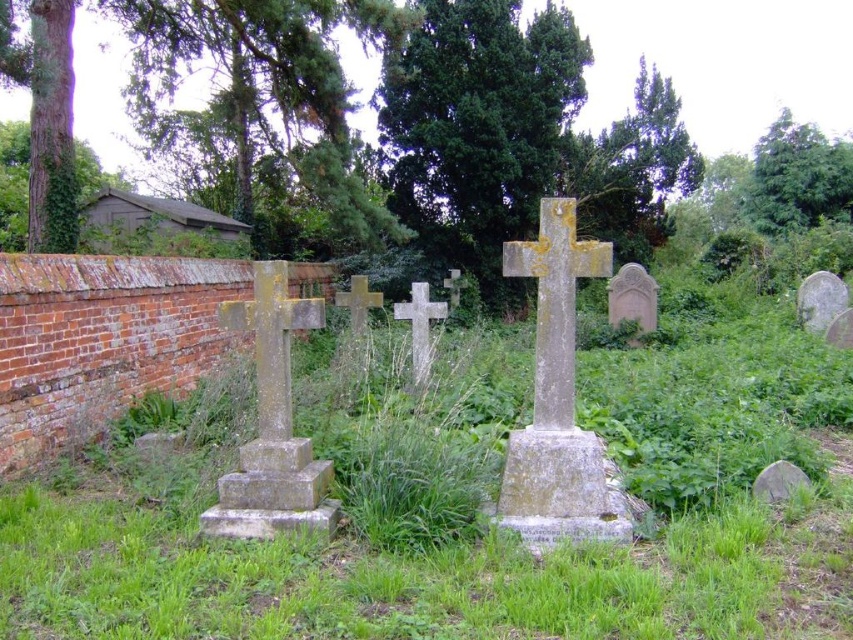
Does green grass at center have a lesser height compared to gold metallic cross at center?

Correct, green grass at center is not as tall as gold metallic cross at center.

In order to click on green grass at center in this screenshot , I will do click(x=457, y=504).

Is point (427, 310) positioned before point (360, 300)?

That is True.

Between point (416, 316) and point (343, 296), which one is positioned in front?

Point (416, 316)

The height and width of the screenshot is (640, 853). Identify the location of stone cross at center. (419, 326).

Who is higher up, yellowish stone cross at center or gold metallic cross at center?

gold metallic cross at center

Is yellowish stone cross at center smaller than gold metallic cross at center?

No.

Measure the distance between yellowish stone cross at center and camera.

They are 4.39 meters apart.

Identify the location of yellowish stone cross at center. (555, 304).